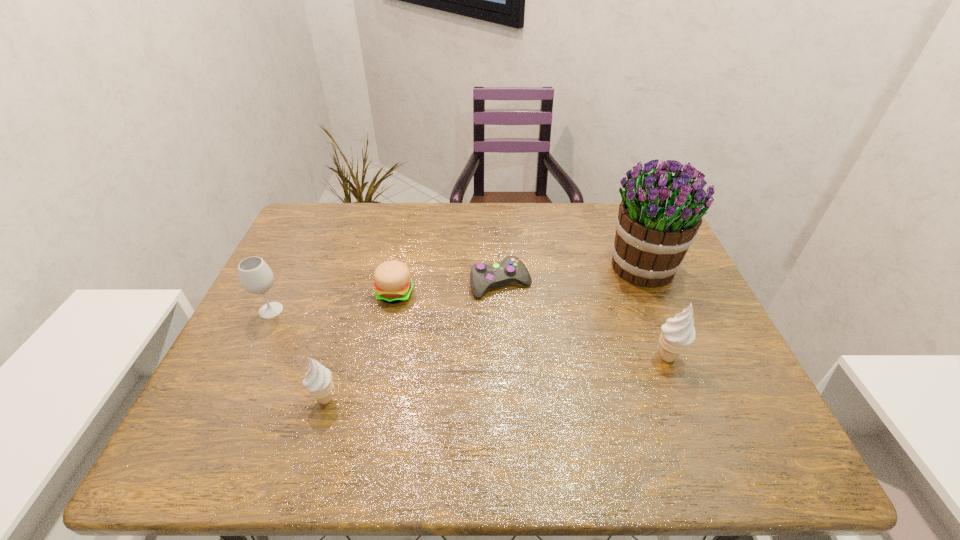
Identify the location of free space located on the front-facing side of the shorter icecream. (265, 400).

Find the location of a particular element. The height and width of the screenshot is (540, 960). vacant space located 0.190m on the front-facing side of the shorter icecream is located at coordinates (222, 400).

Locate an element on the screen. Image resolution: width=960 pixels, height=540 pixels. free space located 0.220m on the front-facing side of the shorter icecream is located at coordinates (208, 400).

Identify the location of blank space located on the front-facing side of the second nearest object. (727, 357).

The height and width of the screenshot is (540, 960). Find the location of `blank space located on the back of the leftmost object`. blank space located on the back of the leftmost object is located at coordinates (293, 266).

Identify the location of vacant space situated 0.370m on the right of the control. click(667, 284).

This screenshot has width=960, height=540. I want to click on vacant space positioned 0.340m on the front of the bouquet, so click(702, 409).

In order to click on free space located on the front of the hamburger in this screenshot , I will do `click(384, 346)`.

You are a GUI agent. You are given a task and a screenshot of the screen. Output one action in this format:
    pyautogui.click(x=<x>, y=<y>)
    Task: Click on the object located at the far edge
    
    Given the screenshot: What is the action you would take?
    pyautogui.click(x=657, y=222)

Locate an element on the screen. object that is at the near edge is located at coordinates (318, 382).